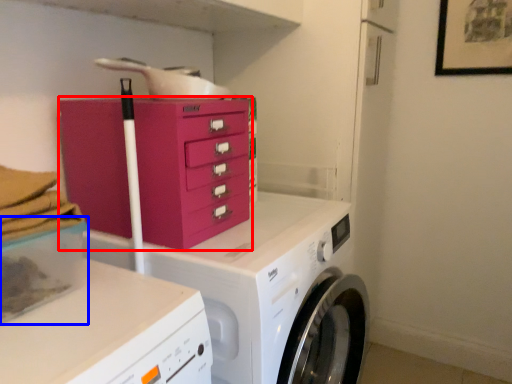
Question: Which of the following is the closest to the observer, chest of drawers (highlighted by a red box) or storage box (highlighted by a blue box)?

Choices:
 (A) chest of drawers
 (B) storage box

Answer: (B)